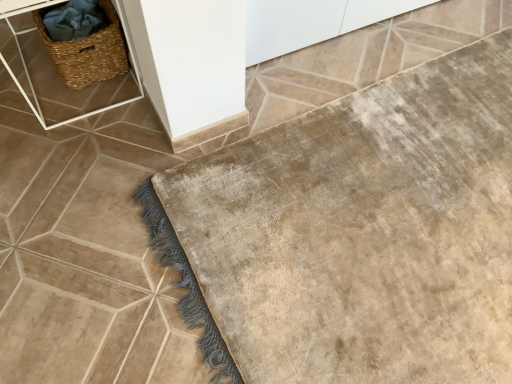
Where is `beige plush bath mat at lower right`? The width and height of the screenshot is (512, 384). beige plush bath mat at lower right is located at coordinates (356, 234).

Locate an element on the screen. The image size is (512, 384). woven brown picnic basket at upper left is located at coordinates (88, 52).

Locate an element on the screen. The width and height of the screenshot is (512, 384). woven straw basket at upper left is located at coordinates (70, 68).

How much distance is there between beige plush bath mat at lower right and woven brown picnic basket at upper left?

They are 93.91 centimeters apart.

Considering the sizes of beige plush bath mat at lower right and woven brown picnic basket at upper left in the image, is beige plush bath mat at lower right wider or thinner than woven brown picnic basket at upper left?

In the image, beige plush bath mat at lower right appears to be wider than woven brown picnic basket at upper left.

Which is more to the left, beige plush bath mat at lower right or woven brown picnic basket at upper left?

From the viewer's perspective, woven brown picnic basket at upper left appears more on the left side.

Is woven straw basket at upper left further to the viewer compared to woven brown picnic basket at upper left?

No.

Does woven straw basket at upper left touch woven brown picnic basket at upper left?

Yes, woven straw basket at upper left is touching woven brown picnic basket at upper left.

From the image's perspective, which is above, woven straw basket at upper left or woven brown picnic basket at upper left?

woven straw basket at upper left.

Between woven straw basket at upper left and beige plush bath mat at lower right, which one has smaller width?

With smaller width is woven straw basket at upper left.

Is beige plush bath mat at lower right located within woven straw basket at upper left?

No, beige plush bath mat at lower right is not surrounded by woven straw basket at upper left.

Does woven straw basket at upper left lie behind beige plush bath mat at lower right?

Yes, woven straw basket at upper left is further from the camera.

From a real-world perspective, is woven straw basket at upper left above or below beige plush bath mat at lower right?

Clearly, from a real-world perspective, woven straw basket at upper left is above beige plush bath mat at lower right.

Considering the sizes of objects woven brown picnic basket at upper left and woven straw basket at upper left in the image provided, who is thinner, woven brown picnic basket at upper left or woven straw basket at upper left?

With smaller width is woven brown picnic basket at upper left.

Looking at this image, from the image's perspective, between woven brown picnic basket at upper left and woven straw basket at upper left, which one is located above?

woven straw basket at upper left.

Is woven brown picnic basket at upper left bigger or smaller than woven straw basket at upper left?

Considering their sizes, woven brown picnic basket at upper left takes up less space than woven straw basket at upper left.

Which is in front, woven brown picnic basket at upper left or woven straw basket at upper left?

woven straw basket at upper left.

Consider the image. Which object is wider, woven brown picnic basket at upper left or beige plush bath mat at lower right?

Wider between the two is beige plush bath mat at lower right.

Is woven brown picnic basket at upper left inside or outside of beige plush bath mat at lower right?

woven brown picnic basket at upper left is not enclosed by beige plush bath mat at lower right.

Between woven brown picnic basket at upper left and beige plush bath mat at lower right, which one is positioned in front?

beige plush bath mat at lower right.

Considering the positions of objects woven brown picnic basket at upper left and beige plush bath mat at lower right in the image provided, who is more to the left, woven brown picnic basket at upper left or beige plush bath mat at lower right?

Positioned to the left is woven brown picnic basket at upper left.

Is beige plush bath mat at lower right located outside woven straw basket at upper left?

Yes, beige plush bath mat at lower right is not within woven straw basket at upper left.

From a real-world perspective, is beige plush bath mat at lower right physically below woven straw basket at upper left?

Yes, from a real-world perspective, beige plush bath mat at lower right is under woven straw basket at upper left.

Which is more to the left, beige plush bath mat at lower right or woven straw basket at upper left?

woven straw basket at upper left is more to the left.

Measure the distance from beige plush bath mat at lower right to woven straw basket at upper left.

The distance of beige plush bath mat at lower right from woven straw basket at upper left is 31.74 inches.

The image size is (512, 384). I want to click on picnic basket on the left of beige plush bath mat at lower right, so coord(88,52).

Image resolution: width=512 pixels, height=384 pixels. Find the location of `picnic basket that is below the woven straw basket at upper left (from the image's perspective)`. picnic basket that is below the woven straw basket at upper left (from the image's perspective) is located at coordinates (88, 52).

Which object lies further to the anchor point woven brown picnic basket at upper left, beige plush bath mat at lower right or woven straw basket at upper left?

beige plush bath mat at lower right.

Looking at the image, which one is located closer to woven straw basket at upper left, woven brown picnic basket at upper left or beige plush bath mat at lower right?

The object closer to woven straw basket at upper left is woven brown picnic basket at upper left.

Estimate the real-world distances between objects in this image. Which object is further from beige plush bath mat at lower right, woven brown picnic basket at upper left or woven straw basket at upper left?

The object further to beige plush bath mat at lower right is woven brown picnic basket at upper left.

Considering their positions, is woven straw basket at upper left positioned closer to woven brown picnic basket at upper left than beige plush bath mat at lower right?

The object closer to woven brown picnic basket at upper left is woven straw basket at upper left.

Based on their spatial positions, is beige plush bath mat at lower right or woven brown picnic basket at upper left further from woven straw basket at upper left?

Based on the image, beige plush bath mat at lower right appears to be further to woven straw basket at upper left.

When comparing their distances from beige plush bath mat at lower right, does woven straw basket at upper left or woven brown picnic basket at upper left seem closer?

woven straw basket at upper left lies closer to beige plush bath mat at lower right than the other object.

The image size is (512, 384). Find the location of `picnic basket situated between woven straw basket at upper left and beige plush bath mat at lower right from left to right`. picnic basket situated between woven straw basket at upper left and beige plush bath mat at lower right from left to right is located at coordinates (88, 52).